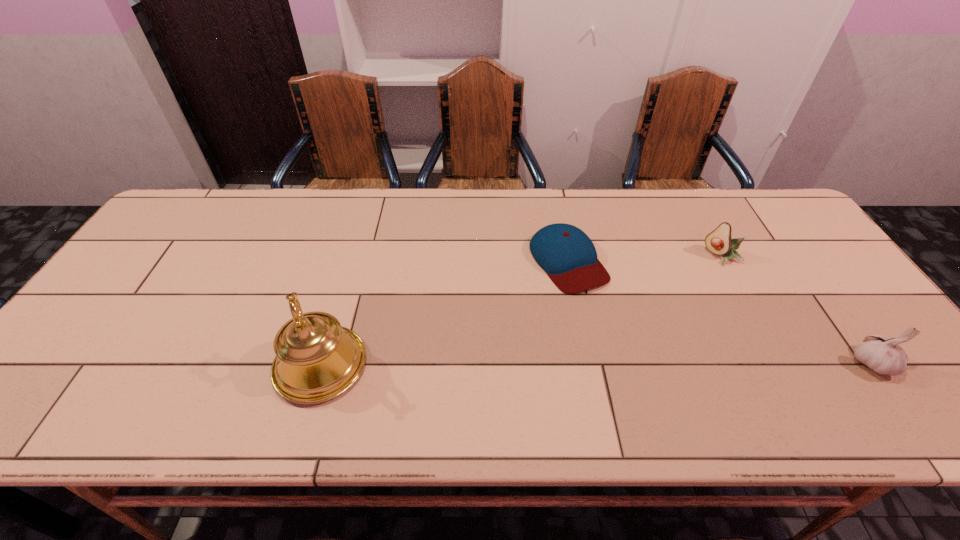
You are a GUI agent. You are given a task and a screenshot of the screen. Output one action in this format:
    pyautogui.click(x=<x>, y=<y>)
    Task: Click on the bell
    This screenshot has width=960, height=540.
    Given the screenshot: What is the action you would take?
    pyautogui.click(x=317, y=359)

This screenshot has width=960, height=540. Identify the location of the tallest object. (317, 359).

The width and height of the screenshot is (960, 540). What are the coordinates of `the rightmost object` in the screenshot? It's located at (884, 356).

Image resolution: width=960 pixels, height=540 pixels. I want to click on the second object from right to left, so click(719, 241).

You are a GUI agent. You are given a task and a screenshot of the screen. Output one action in this format:
    pyautogui.click(x=<x>, y=<y>)
    Task: Click on the second object from left to right
    
    Given the screenshot: What is the action you would take?
    pyautogui.click(x=568, y=256)

Locate an element on the screen. baseball cap is located at coordinates (568, 256).

Locate an element on the screen. The width and height of the screenshot is (960, 540). vacant area located on the back of the leftmost object is located at coordinates (353, 253).

This screenshot has width=960, height=540. Identify the location of free region located on the left of the garlic. (722, 362).

The image size is (960, 540). What are the coordinates of `free space located 0.150m on the seed side of the avocado` in the screenshot? It's located at click(x=682, y=288).

In order to click on free location located on the seed side of the avocado in this screenshot , I will do `click(643, 320)`.